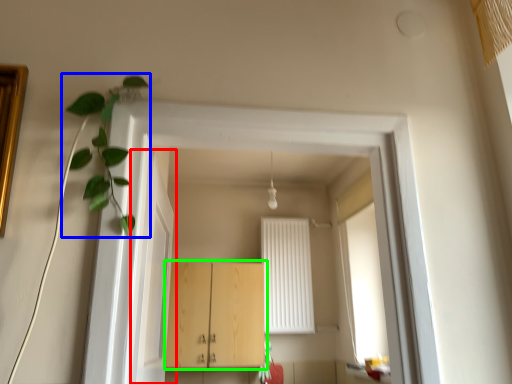
Question: Considering the real-world distances, which object is farthest from door (highlighted by a red box)? plant (highlighted by a blue box) or cabinetry (highlighted by a green box)?

Choices:
 (A) plant
 (B) cabinetry

Answer: (B)